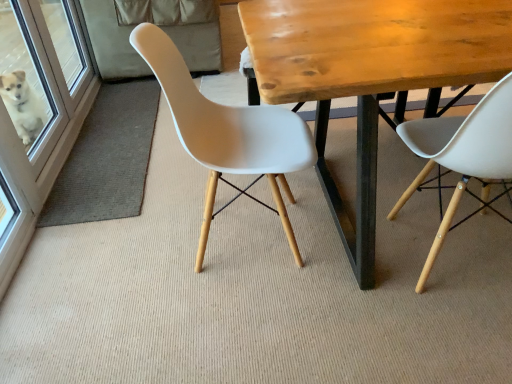
You are a GUI agent. You are given a task and a screenshot of the screen. Output one action in this format:
    pyautogui.click(x=<x>, y=<y>)
    Task: Click on the vacant space situated on the left part of white plastic chair at center, the 1th chair positioned from the left
    
    Given the screenshot: What is the action you would take?
    pyautogui.click(x=130, y=253)